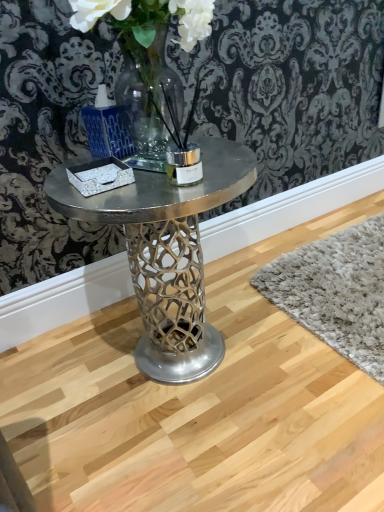
This screenshot has height=512, width=384. I want to click on free space underneath metallic silver table at center (from a real-world perspective), so click(161, 378).